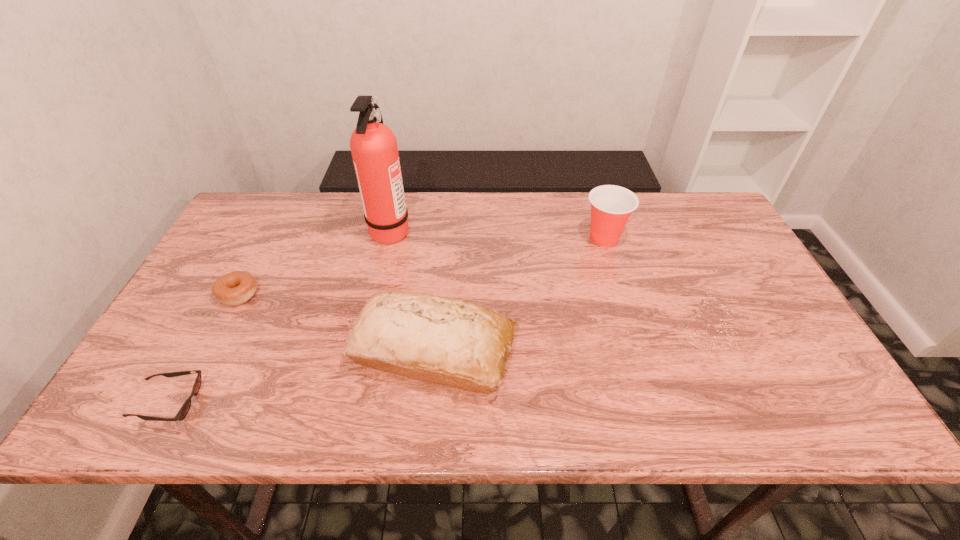
You are a GUI agent. You are given a task and a screenshot of the screen. Output one action in this format:
    pyautogui.click(x=<x>, y=<y>)
    Task: Click on the free space that is in between the second shortest object and the sunglasses
    
    Given the screenshot: What is the action you would take?
    pyautogui.click(x=204, y=348)

This screenshot has width=960, height=540. Identify the location of free space between the sunglasses and the bread. (301, 376).

The image size is (960, 540). In order to click on the closest object to the rightmost object in this screenshot , I will do `click(445, 341)`.

Identify which object is located as the third nearest to the sunglasses. Please provide its 2D coordinates. Your answer should be formatted as a tuple, i.e. [(x, y)], where the tuple contains the x and y coordinates of a point satisfying the conditions above.

[(373, 145)]

The height and width of the screenshot is (540, 960). In order to click on vacant region that satisfies the following two spatial constraints: 1. on the handle side of the fire extinguisher; 2. on the back side of the rightmost object in this screenshot , I will do `click(389, 238)`.

Where is `vacant space that satisfies the following two spatial constraints: 1. on the handle side of the rightmost object; 2. on the left side of the tallest object`? The image size is (960, 540). vacant space that satisfies the following two spatial constraints: 1. on the handle side of the rightmost object; 2. on the left side of the tallest object is located at coordinates (389, 238).

The width and height of the screenshot is (960, 540). I want to click on vacant position in the image that satisfies the following two spatial constraints: 1. on the handle side of the fire extinguisher; 2. on the back side of the bread, so click(x=364, y=350).

Identify the location of free space in the image that satisfies the following two spatial constraints: 1. on the handle side of the cup; 2. on the left side of the fire extinguisher. This screenshot has width=960, height=540. (389, 238).

The image size is (960, 540). I want to click on vacant space that satisfies the following two spatial constraints: 1. on the back side of the bread; 2. on the right side of the rightmost object, so click(444, 238).

Where is `blank space that satisfies the following two spatial constraints: 1. on the front side of the bagel; 2. on the front-facing side of the sunglasses`? Image resolution: width=960 pixels, height=540 pixels. blank space that satisfies the following two spatial constraints: 1. on the front side of the bagel; 2. on the front-facing side of the sunglasses is located at coordinates (182, 402).